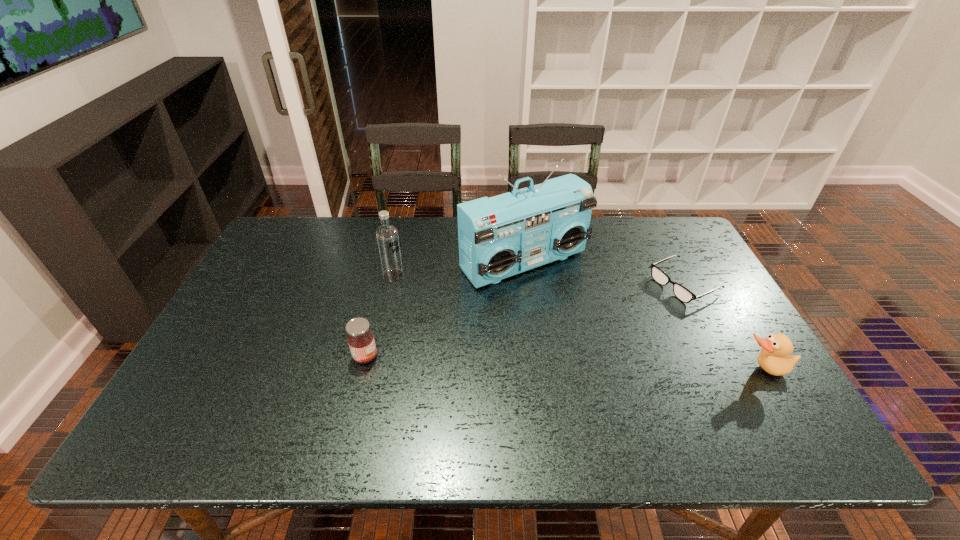
This screenshot has width=960, height=540. I want to click on vacant area located on the front label of the second tallest object, so click(432, 298).

Where is `vacant region located 0.310m on the front-facing side of the radio receiver`? vacant region located 0.310m on the front-facing side of the radio receiver is located at coordinates (635, 368).

You are a GUI agent. You are given a task and a screenshot of the screen. Output one action in this format:
    pyautogui.click(x=<x>, y=<y>)
    Task: Click on the blank area located on the front-facing side of the radio receiver
    
    Given the screenshot: What is the action you would take?
    pyautogui.click(x=640, y=374)

You are a GUI agent. You are given a task and a screenshot of the screen. Output one action in this format:
    pyautogui.click(x=<x>, y=<y>)
    Task: Click on the free space located on the front-facing side of the radio receiver
    Image resolution: width=960 pixels, height=540 pixels.
    Given the screenshot: What is the action you would take?
    pyautogui.click(x=612, y=346)

Where is `free space located 0.320m on the front-facing side of the shortest object`? free space located 0.320m on the front-facing side of the shortest object is located at coordinates (572, 336).

The image size is (960, 540). I want to click on free space located on the front-facing side of the shortest object, so click(564, 341).

Where is `vacant space located 0.080m on the front-facing side of the shortest object`? The image size is (960, 540). vacant space located 0.080m on the front-facing side of the shortest object is located at coordinates click(x=640, y=305).

The height and width of the screenshot is (540, 960). I want to click on object present at the far edge, so click(x=501, y=236).

The image size is (960, 540). Find the location of `object situated at the near edge`. object situated at the near edge is located at coordinates (773, 358).

The height and width of the screenshot is (540, 960). I want to click on duck situated at the right edge, so click(773, 358).